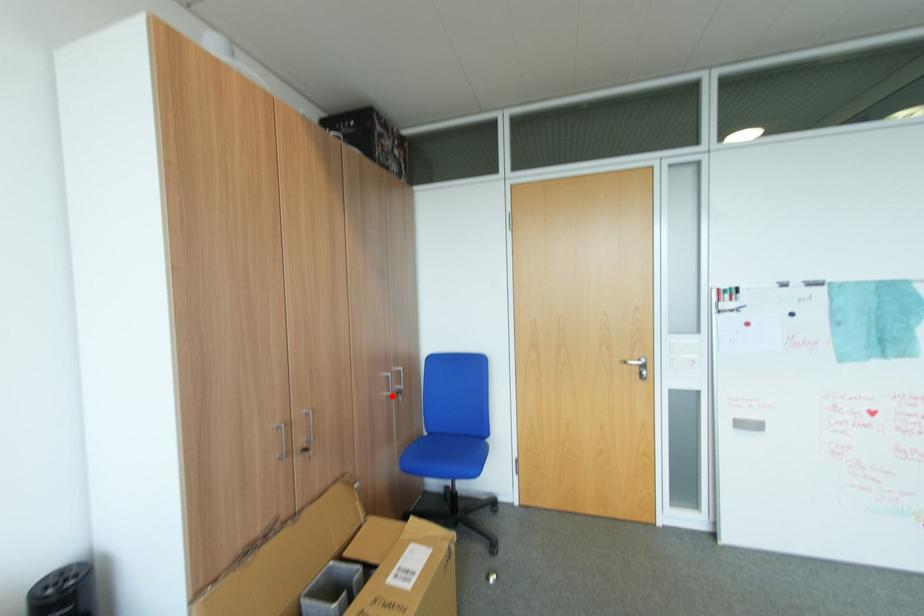
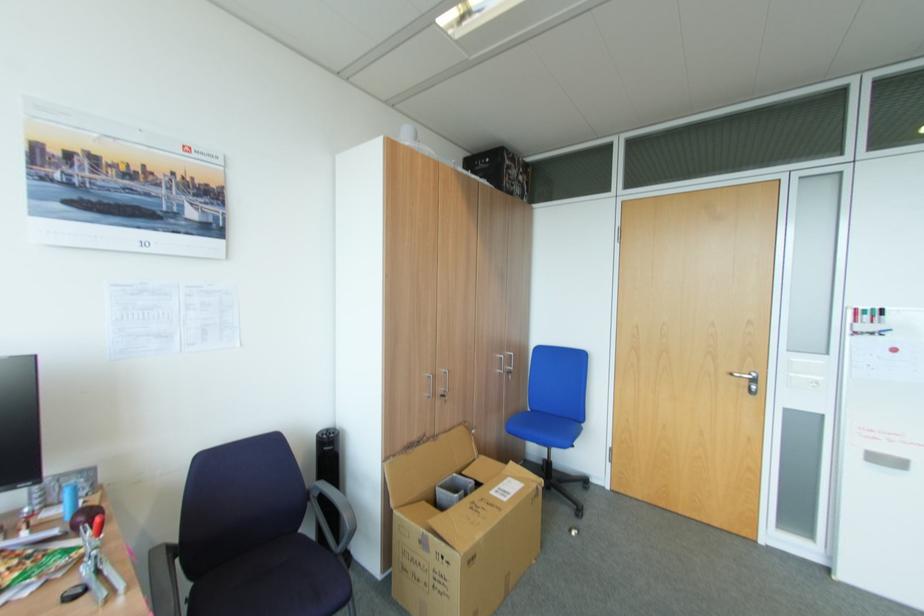
Question: I am providing you with two images of the same scene from different viewpoints. Image1 has a red point marked. In image2, the corresponding 3D location appears at what relative position? Reply with the corresponding letter.

Choices:
 (A) Closer
 (B) Farther

Answer: (B)